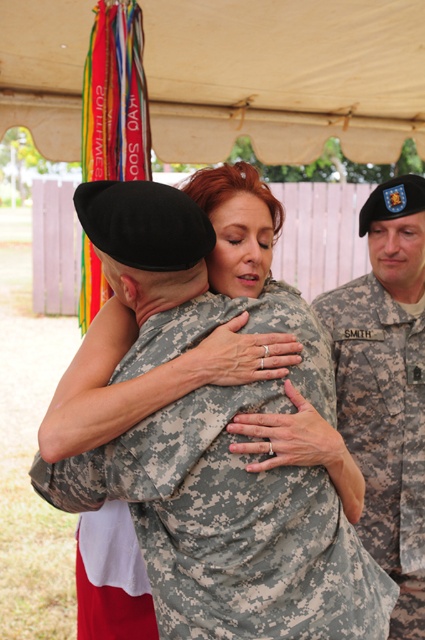
Is point (221, 40) farther from viewer compared to point (424, 236)?

Yes, point (221, 40) is behind point (424, 236).

Between white fabric canopy at upper center and camouflage uniform at center, which one is positioned higher?

Positioned higher is white fabric canopy at upper center.

Locate an element on the screen. The height and width of the screenshot is (640, 425). white fabric canopy at upper center is located at coordinates (283, 77).

Which is more to the right, camouflage fabric uniform at center or white fabric canopy at upper center?

camouflage fabric uniform at center is more to the right.

Does camouflage fabric uniform at center have a lesser height compared to white fabric canopy at upper center?

Yes, camouflage fabric uniform at center is shorter than white fabric canopy at upper center.

Is point (277, 563) farther from camera compared to point (150, 76)?

No, (277, 563) is in front of (150, 76).

Find the location of a particular element. The width and height of the screenshot is (425, 640). camouflage fabric uniform at center is located at coordinates (x=229, y=528).

Is camouflage fabric uniform at center smaller than camouflage uniform at center?

Yes, camouflage fabric uniform at center is smaller than camouflage uniform at center.

Is point (295, 550) closer to viewer compared to point (399, 244)?

That is True.

Where is `camouflage fabric uniform at center`? This screenshot has height=640, width=425. camouflage fabric uniform at center is located at coordinates (229, 528).